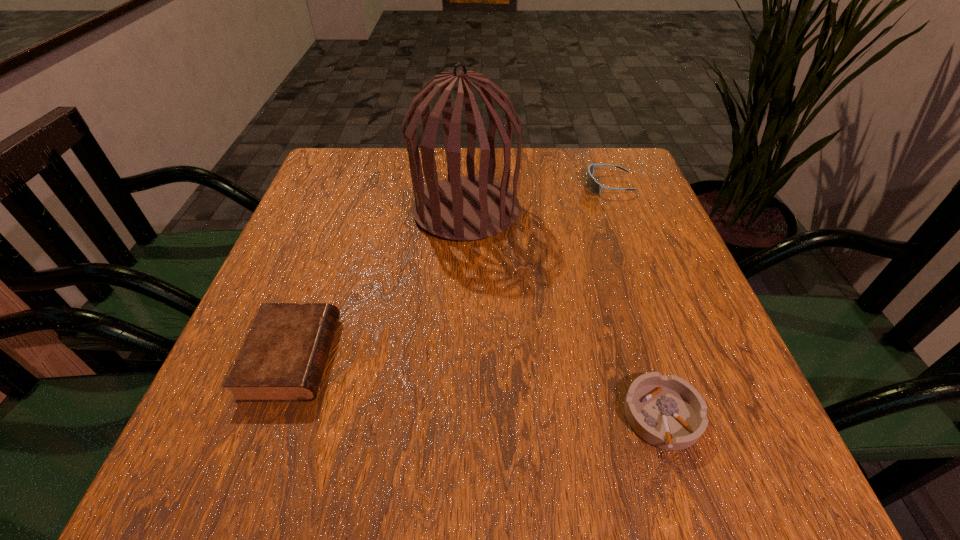
Locate an element on the screen. vacant space at the left edge of the desktop is located at coordinates (316, 262).

The width and height of the screenshot is (960, 540). In order to click on blank space at the right edge in this screenshot , I will do `click(695, 318)`.

Image resolution: width=960 pixels, height=540 pixels. In the image, there is a desktop. Find the location of `vacant region at the far left corner`. vacant region at the far left corner is located at coordinates (381, 160).

In the image, there is a desktop. In order to click on vacant space at the far right corner in this screenshot , I will do `click(614, 179)`.

Where is `empty location between the second object from left to right and the shortest object`? The image size is (960, 540). empty location between the second object from left to right and the shortest object is located at coordinates (564, 314).

The image size is (960, 540). I want to click on empty location between the birdcage and the diary, so click(x=379, y=284).

The height and width of the screenshot is (540, 960). I want to click on vacant area between the goggles and the diary, so click(x=450, y=271).

Find the location of a particular element. vacant space in between the ashtray and the diary is located at coordinates (477, 387).

You are a GUI agent. You are given a task and a screenshot of the screen. Output one action in this format:
    pyautogui.click(x=<x>, y=<y>)
    Task: Click on the free space between the shortest object and the goggles
    The image size is (960, 540).
    Given the screenshot: What is the action you would take?
    pyautogui.click(x=636, y=301)

The height and width of the screenshot is (540, 960). I want to click on free space between the leftmost object and the goggles, so click(x=450, y=271).